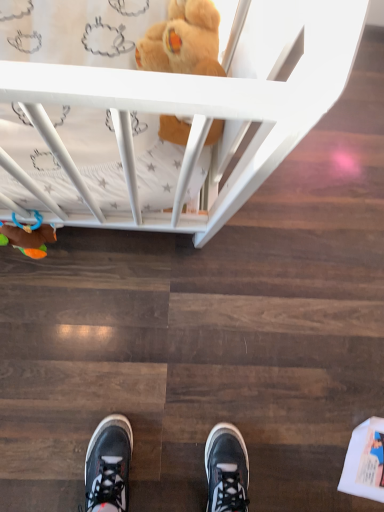
Where is `soft plush toy at lower left, placed as the first toy when sorted from bottom to top`? soft plush toy at lower left, placed as the first toy when sorted from bottom to top is located at coordinates (29, 239).

Describe the element at coordinates (29, 239) in the screenshot. I see `soft plush toy at lower left, placed as the first toy when sorted from bottom to top` at that location.

Image resolution: width=384 pixels, height=512 pixels. Find the location of `soft plush bear at upper center, the second toy viewed from the left`. soft plush bear at upper center, the second toy viewed from the left is located at coordinates (183, 41).

The height and width of the screenshot is (512, 384). What do you see at coordinates (183, 41) in the screenshot?
I see `soft plush bear at upper center, the second toy viewed from the left` at bounding box center [183, 41].

What are the coordinates of `soft plush toy at lower left, acting as the 1th toy starting from the left` in the screenshot? It's located at (29, 239).

Between soft plush bear at upper center, which is the first toy from right to left, and soft plush toy at lower left, marked as the 2th toy in a top-to-bottom arrangement, which one appears on the left side from the viewer's perspective?

soft plush toy at lower left, marked as the 2th toy in a top-to-bottom arrangement, is more to the left.

In the image, is soft plush bear at upper center, the second toy viewed from the left, positioned in front of or behind soft plush toy at lower left, acting as the 1th toy starting from the left?

Visually, soft plush bear at upper center, the second toy viewed from the left, is located in front of soft plush toy at lower left, acting as the 1th toy starting from the left.

Does point (193, 3) lie in front of point (44, 245)?

That is True.

From the image's perspective, is soft plush bear at upper center, which is the first toy from top to bottom, positioned above or below soft plush toy at lower left, acting as the 1th toy starting from the left?

soft plush bear at upper center, which is the first toy from top to bottom, is situated higher than soft plush toy at lower left, acting as the 1th toy starting from the left, in the image.

From a real-world perspective, which is physically above, soft plush bear at upper center, the second toy viewed from the left, or soft plush toy at lower left, placed as the first toy when sorted from bottom to top?

In real-world perspective, soft plush bear at upper center, the second toy viewed from the left, is above.

Looking at their sizes, would you say soft plush bear at upper center, the second toy viewed from the left, is wider or thinner than soft plush toy at lower left, placed as the first toy when sorted from bottom to top?

In the image, soft plush bear at upper center, the second toy viewed from the left, appears to be wider than soft plush toy at lower left, placed as the first toy when sorted from bottom to top.

In terms of height, does soft plush bear at upper center, which is the first toy from top to bottom, look taller or shorter compared to soft plush toy at lower left, acting as the 1th toy starting from the left?

soft plush bear at upper center, which is the first toy from top to bottom, is taller than soft plush toy at lower left, acting as the 1th toy starting from the left.

Based on the photo, can you confirm if soft plush bear at upper center, which is the first toy from right to left, is smaller than soft plush toy at lower left, marked as the 2th toy in a top-to-bottom arrangement?

Actually, soft plush bear at upper center, which is the first toy from right to left, might be larger than soft plush toy at lower left, marked as the 2th toy in a top-to-bottom arrangement.

Is soft plush bear at upper center, which is the first toy from right to left, inside or outside of soft plush toy at lower left, placed as the first toy when sorted from bottom to top?

soft plush bear at upper center, which is the first toy from right to left, cannot be found inside soft plush toy at lower left, placed as the first toy when sorted from bottom to top.

Is soft plush bear at upper center, which is the first toy from top to bottom, directly adjacent to soft plush toy at lower left, acting as the 1th toy starting from the left?

No, soft plush bear at upper center, which is the first toy from top to bottom, is not beside soft plush toy at lower left, acting as the 1th toy starting from the left.

Is soft plush bear at upper center, which is the first toy from right to left, oriented towards soft plush toy at lower left, placed as the first toy when sorted from bottom to top?

No, soft plush bear at upper center, which is the first toy from right to left, is not aimed at soft plush toy at lower left, placed as the first toy when sorted from bottom to top.

How different are the orientations of soft plush bear at upper center, the second toy viewed from the left, and soft plush toy at lower left, placed as the first toy when sorted from bottom to top, in degrees?

soft plush bear at upper center, the second toy viewed from the left, and soft plush toy at lower left, placed as the first toy when sorted from bottom to top, are facing 0.00109 degrees away from each other.

Locate an element on the screen. This screenshot has height=512, width=384. toy above the soft plush toy at lower left, which is counted as the second toy, starting from the right (from the image's perspective) is located at coordinates (183, 41).

Which object is positioned more to the right, soft plush toy at lower left, acting as the 1th toy starting from the left, or soft plush bear at upper center, the second toy when ordered from bottom to top?

soft plush bear at upper center, the second toy when ordered from bottom to top, is more to the right.

In the scene shown: Considering their positions, is soft plush toy at lower left, placed as the first toy when sorted from bottom to top, located in front of or behind soft plush bear at upper center, which is the first toy from top to bottom?

soft plush toy at lower left, placed as the first toy when sorted from bottom to top, is positioned farther from the viewer than soft plush bear at upper center, which is the first toy from top to bottom.

Is point (6, 228) positioned after point (164, 35)?

Yes.

From the image's perspective, is soft plush toy at lower left, acting as the 1th toy starting from the left, on soft plush bear at upper center, which is the first toy from right to left?

Actually, soft plush toy at lower left, acting as the 1th toy starting from the left, appears below soft plush bear at upper center, which is the first toy from right to left, in the image.

From a real-world perspective, which object rests below the other?

From a 3D spatial view, soft plush toy at lower left, placed as the first toy when sorted from bottom to top, is below.

Which of these two, soft plush toy at lower left, marked as the 2th toy in a top-to-bottom arrangement, or soft plush bear at upper center, which is the first toy from right to left, is thinner?

Thinner between the two is soft plush toy at lower left, marked as the 2th toy in a top-to-bottom arrangement.

Considering the relative sizes of soft plush toy at lower left, marked as the 2th toy in a top-to-bottom arrangement, and soft plush bear at upper center, which is the first toy from top to bottom, in the image provided, is soft plush toy at lower left, marked as the 2th toy in a top-to-bottom arrangement, shorter than soft plush bear at upper center, which is the first toy from top to bottom,?

Indeed, soft plush toy at lower left, marked as the 2th toy in a top-to-bottom arrangement, has a lesser height compared to soft plush bear at upper center, which is the first toy from top to bottom.

In the scene shown: Considering the relative sizes of soft plush toy at lower left, acting as the 1th toy starting from the left, and soft plush bear at upper center, the second toy viewed from the left, in the image provided, is soft plush toy at lower left, acting as the 1th toy starting from the left, smaller than soft plush bear at upper center, the second toy viewed from the left,?

Correct, soft plush toy at lower left, acting as the 1th toy starting from the left, occupies less space than soft plush bear at upper center, the second toy viewed from the left.

Is soft plush toy at lower left, marked as the 2th toy in a top-to-bottom arrangement, situated inside soft plush bear at upper center, the second toy viewed from the left, or outside?

soft plush toy at lower left, marked as the 2th toy in a top-to-bottom arrangement, exists outside the volume of soft plush bear at upper center, the second toy viewed from the left.

Are soft plush toy at lower left, marked as the 2th toy in a top-to-bottom arrangement, and soft plush bear at upper center, which is the first toy from top to bottom, making contact?

soft plush toy at lower left, marked as the 2th toy in a top-to-bottom arrangement, and soft plush bear at upper center, which is the first toy from top to bottom, are clearly separated.

Based on the photo, does soft plush toy at lower left, which is counted as the second toy, starting from the right, turn towards soft plush bear at upper center, the second toy when ordered from bottom to top?

No, soft plush toy at lower left, which is counted as the second toy, starting from the right, does not turn towards soft plush bear at upper center, the second toy when ordered from bottom to top.

At what (x,y) coordinates should I click in order to perform the action: click on toy located above the soft plush toy at lower left, marked as the 2th toy in a top-to-bottom arrangement (from a real-world perspective). Please return your answer as a coordinate pair (x, y). The image size is (384, 512). Looking at the image, I should click on (183, 41).

The width and height of the screenshot is (384, 512). What are the coordinates of `toy located above the soft plush toy at lower left, acting as the 1th toy starting from the left (from the image's perspective)` in the screenshot? It's located at pos(183,41).

Where is `toy behind the soft plush bear at upper center, which is the first toy from right to left`? The width and height of the screenshot is (384, 512). toy behind the soft plush bear at upper center, which is the first toy from right to left is located at coordinates (29, 239).